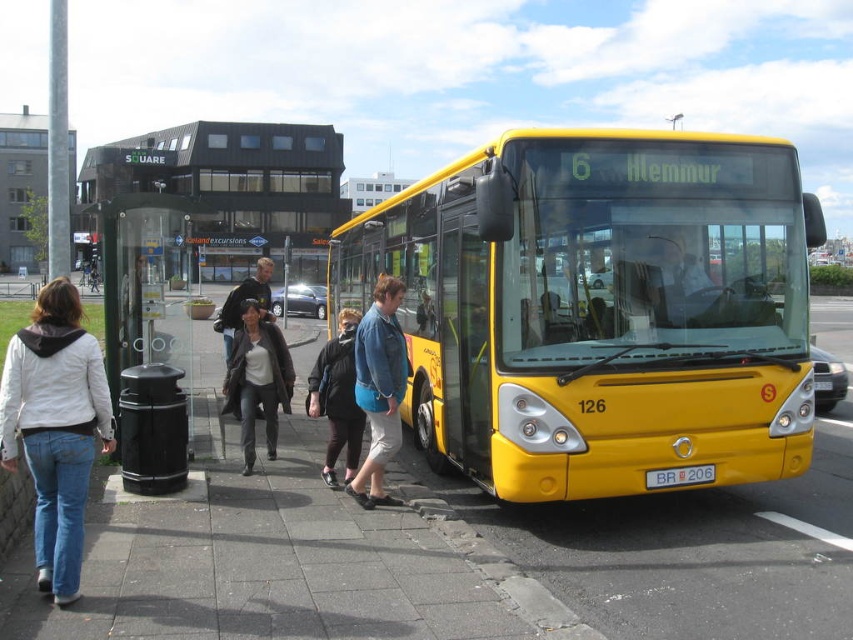
You are a passenger waiting at the bus stop and want to board the yellow city bus on the right. You notice two jackets hanging on the back of the seat in front of you. Which jacket is closer to you, the dark brown leather jacket at center or the black fabric jacket at center?

The dark brown leather jacket at center is closer to you because the black fabric jacket at center is positioned behind it.

You are standing at the bus stop and want to reach the point marked at coordinates point (83, 460). If your walking distance is limited to 15 feet, can you safely reach it?

The point (83, 460) is 13.84 feet away from the viewer, so yes, you can safely reach it within your 15 feet walking limit.